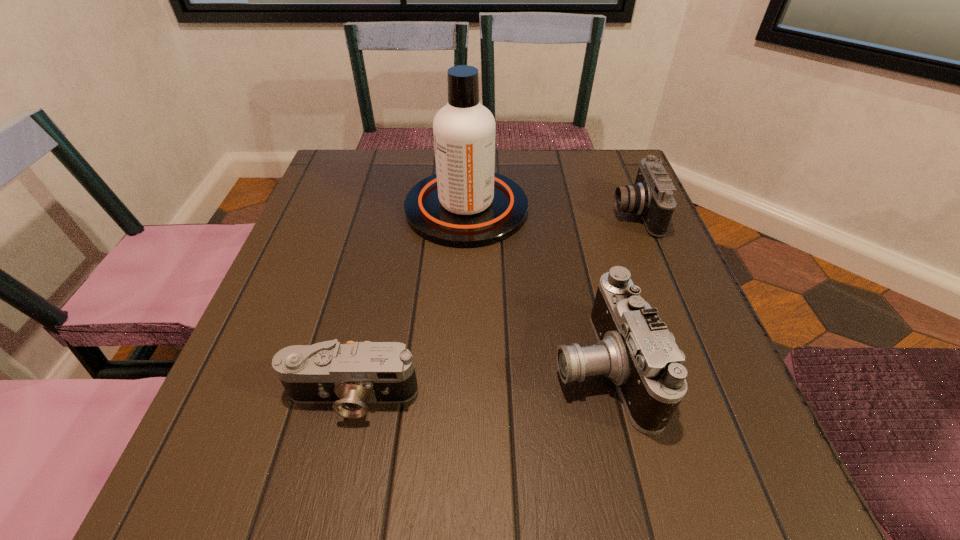
Locate an element on the screen. This screenshot has height=540, width=960. vacant point located 0.250m on the front-facing side of the rightmost object is located at coordinates (504, 213).

Locate an element on the screen. vacant area situated on the front-facing side of the rightmost object is located at coordinates (508, 213).

The width and height of the screenshot is (960, 540). What are the coordinates of `free region located 0.200m on the front-facing side of the rightmost object` in the screenshot? It's located at (526, 213).

Image resolution: width=960 pixels, height=540 pixels. What are the coordinates of `free space located on the lens of the shortest object` in the screenshot? It's located at (330, 494).

At what (x,y) coordinates should I click in order to perform the action: click on cleansing agent at the far edge. Please return your answer as a coordinate pair (x, y). Looking at the image, I should click on (466, 204).

Locate an element on the screen. camera at the far edge is located at coordinates (651, 196).

What are the coordinates of `object located in the left edge section of the desktop` in the screenshot? It's located at (349, 376).

Identify the location of object at the far right corner. (651, 196).

Locate an element on the screen. The height and width of the screenshot is (540, 960). vacant space at the far edge of the desktop is located at coordinates (530, 159).

You are a GUI agent. You are given a task and a screenshot of the screen. Output one action in this format:
    pyautogui.click(x=<x>, y=<y>)
    Task: Click on the free space at the near edge of the desktop
    This screenshot has height=540, width=960.
    Given the screenshot: What is the action you would take?
    coord(593,479)